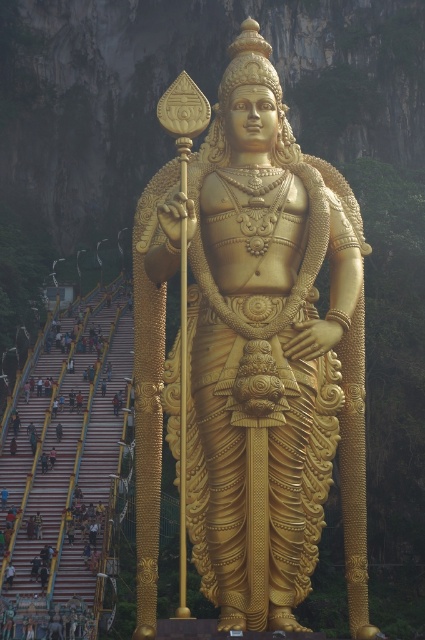
Question: Does golden statue at center have a greater width compared to light brown fabric pants at lower center?

Choices:
 (A) yes
 (B) no

Answer: (A)

Question: Which point is closer to the camera?

Choices:
 (A) (218, 337)
 (B) (48, 452)

Answer: (A)

Question: Which point is closer to the camera?

Choices:
 (A) light brown fabric pants at lower center
 (B) golden statue at center
 (C) golden polished statue at center

Answer: (C)

Question: Is golden statue at center positioned at the back of light brown fabric pants at lower center?

Choices:
 (A) no
 (B) yes

Answer: (A)

Question: Which of the following is the closest to the observer?

Choices:
 (A) (50, 456)
 (B) (45, 454)

Answer: (A)

Question: Considering the relative positions of golden polished statue at center and light brown fabric pants at lower center in the image provided, where is golden polished statue at center located with respect to light brown fabric pants at lower center?

Choices:
 (A) below
 (B) above

Answer: (B)